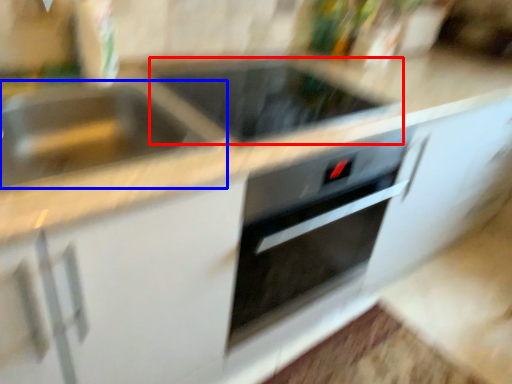
Question: Among these objects, which one is nearest to the camera, appliance (highlighted by a red box) or sink (highlighted by a blue box)?

Choices:
 (A) appliance
 (B) sink

Answer: (B)